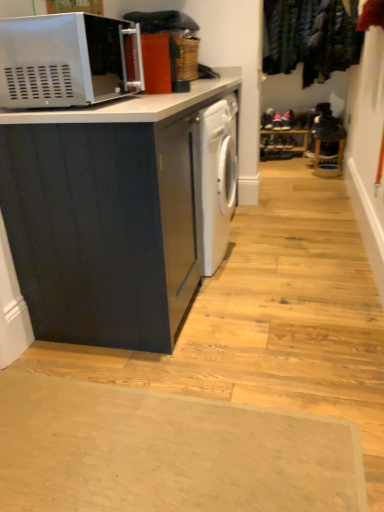
Image resolution: width=384 pixels, height=512 pixels. I want to click on beige rubber doormat at lower center, so click(x=167, y=452).

The image size is (384, 512). Identify the location of satin silver microwave at upper left. (68, 60).

Locate an element on the screen. This screenshot has height=512, width=384. velvet green coat at upper right is located at coordinates (310, 38).

The height and width of the screenshot is (512, 384). I want to click on beige rubber doormat at lower center, so click(x=167, y=452).

Is velvet green coat at upper right not close to satin silver microwave at upper left?

Yes, velvet green coat at upper right is far from satin silver microwave at upper left.

Considering the relative sizes of velvet green coat at upper right and satin silver microwave at upper left in the image provided, is velvet green coat at upper right thinner than satin silver microwave at upper left?

Correct, the width of velvet green coat at upper right is less than that of satin silver microwave at upper left.

Is velvet green coat at upper right oriented away from satin silver microwave at upper left?

No, velvet green coat at upper right's orientation is not away from satin silver microwave at upper left.

Considering the sizes of objects beige rubber doormat at lower center and satin silver microwave at upper left in the image provided, who is thinner, beige rubber doormat at lower center or satin silver microwave at upper left?

With smaller width is satin silver microwave at upper left.

Is beige rubber doormat at lower center far away from satin silver microwave at upper left?

That's right, there is a large distance between beige rubber doormat at lower center and satin silver microwave at upper left.

In terms of height, does beige rubber doormat at lower center look taller or shorter compared to satin silver microwave at upper left?

Clearly, beige rubber doormat at lower center is shorter compared to satin silver microwave at upper left.

Where is `microwave oven located behind the beige rubber doormat at lower center`? microwave oven located behind the beige rubber doormat at lower center is located at coordinates (68, 60).

From the image's perspective, which is above, matte black cabinet at left or beige rubber doormat at lower center?

matte black cabinet at left is shown above in the image.

In terms of width, does matte black cabinet at left look wider or thinner when compared to beige rubber doormat at lower center?

Clearly, matte black cabinet at left has less width compared to beige rubber doormat at lower center.

Does matte black cabinet at left turn towards beige rubber doormat at lower center?

No.

Considering the relative sizes of beige rubber doormat at lower center and matte black cabinet at left in the image provided, is beige rubber doormat at lower center smaller than matte black cabinet at left?

Yes, beige rubber doormat at lower center is smaller than matte black cabinet at left.

In terms of height, does beige rubber doormat at lower center look taller or shorter compared to matte black cabinet at left?

Clearly, beige rubber doormat at lower center is shorter compared to matte black cabinet at left.

From the image's perspective, between beige rubber doormat at lower center and matte black cabinet at left, who is located below?

From the image's view, beige rubber doormat at lower center is below.

In the scene shown: From a real-world perspective, does beige rubber doormat at lower center stand above matte black cabinet at left?

Incorrect, from a real-world perspective, beige rubber doormat at lower center is lower than matte black cabinet at left.

I want to click on cabinetry that is in front of the velvet green coat at upper right, so click(x=108, y=215).

Is velvet green coat at upper right completely or partially inside matte black cabinet at left?

No, velvet green coat at upper right is located outside of matte black cabinet at left.

From a real-world perspective, is matte black cabinet at left on top of velvet green coat at upper right?

Actually, matte black cabinet at left is physically below velvet green coat at upper right in the real world.

Which of these two, matte black cabinet at left or velvet green coat at upper right, stands shorter?

Standing shorter between the two is velvet green coat at upper right.

Is velvet green coat at upper right facing towards matte black cabinet at left?

Yes, velvet green coat at upper right is turned towards matte black cabinet at left.

Considering the sizes of velvet green coat at upper right and matte black cabinet at left in the image, is velvet green coat at upper right taller or shorter than matte black cabinet at left?

Considering their sizes, velvet green coat at upper right has less height than matte black cabinet at left.

Is point (267, 21) closer to viewer compared to point (50, 152)?

No, it is behind (50, 152).

Who is bigger, velvet green coat at upper right or matte black cabinet at left?

With larger size is matte black cabinet at left.

Which object is closer to the camera taking this photo, velvet green coat at upper right or beige rubber doormat at lower center?

beige rubber doormat at lower center is more forward.

Does point (298, 57) lie behind point (0, 474)?

Yes, it is.

Which of these two, velvet green coat at upper right or beige rubber doormat at lower center, is bigger?

velvet green coat at upper right is bigger.

Identify the location of laundry above the satin silver microwave at upper left (from the image's perspective). This screenshot has height=512, width=384. (310, 38).

At what (x,y) coordinates should I click in order to perform the action: click on doormat that is under the satin silver microwave at upper left (from a real-world perspective). Please return your answer as a coordinate pair (x, y). This screenshot has width=384, height=512. Looking at the image, I should click on (167, 452).

Looking at the image, which one is located further to beige rubber doormat at lower center, satin silver microwave at upper left or matte black cabinet at left?

The object further to beige rubber doormat at lower center is satin silver microwave at upper left.

From the image, which object appears to be nearer to satin silver microwave at upper left, velvet green coat at upper right or matte black cabinet at left?

matte black cabinet at left is closer to satin silver microwave at upper left.

Looking at the image, which one is located further to velvet green coat at upper right, matte black cabinet at left or beige rubber doormat at lower center?

The object further to velvet green coat at upper right is beige rubber doormat at lower center.

From the image, which object appears to be farther from beige rubber doormat at lower center, matte black cabinet at left or velvet green coat at upper right?

Among the two, velvet green coat at upper right is located further to beige rubber doormat at lower center.

From the image, which object appears to be nearer to beige rubber doormat at lower center, matte black cabinet at left or satin silver microwave at upper left?

Based on the image, matte black cabinet at left appears to be nearer to beige rubber doormat at lower center.

From the image, which object appears to be farther from velvet green coat at upper right, satin silver microwave at upper left or beige rubber doormat at lower center?

beige rubber doormat at lower center is further to velvet green coat at upper right.

Looking at the image, which one is located further to matte black cabinet at left, beige rubber doormat at lower center or satin silver microwave at upper left?

The object further to matte black cabinet at left is beige rubber doormat at lower center.

From the image, which object appears to be nearer to satin silver microwave at upper left, beige rubber doormat at lower center or velvet green coat at upper right?

beige rubber doormat at lower center.

Identify the location of cabinetry between satin silver microwave at upper left and beige rubber doormat at lower center in the up-down direction. This screenshot has width=384, height=512. (108, 215).

The width and height of the screenshot is (384, 512). In order to click on microwave oven positioned between beige rubber doormat at lower center and velvet green coat at upper right from near to far in this screenshot , I will do `click(68, 60)`.

Locate an element on the screen. This screenshot has height=512, width=384. cabinetry between beige rubber doormat at lower center and velvet green coat at upper right in the front-back direction is located at coordinates (108, 215).

What are the coordinates of `cabinetry between satin silver microwave at upper left and velvet green coat at upper right from front to back` in the screenshot? It's located at pos(108,215).